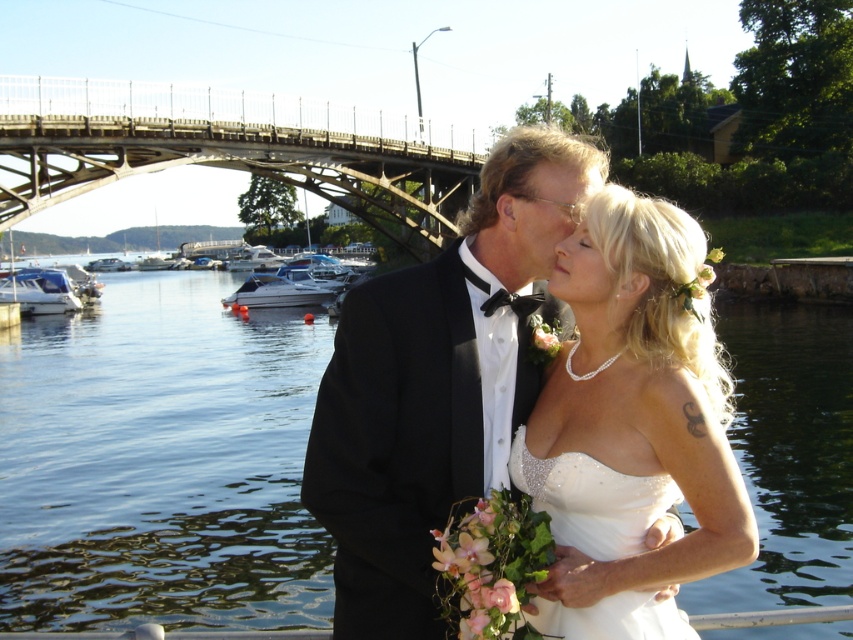
You are a photographer at a waterfront wedding. You need to position a spotlight at the point with coordinates point (221, 154). What object should the spotlight illuminate?

The point (221, 154) indicates the metallic bridge at upper center, so the spotlight should illuminate the metallic bridge at upper center.

You are a photographer at the wedding. You want to capture the couple standing so that the white satin cocktail dress at center is positioned to the right of the clear water at center. Is this possible based on the current scene?

Yes, because the clear water at center is already to the left of the white satin cocktail dress at center, so the dress is naturally positioned to the right of the water.

You are a photographer standing at the waterfront where the wedding couple is posing. You want to take a photo that includes both the clear water at center and the white satin cocktail dress at center. Which object will appear closer to you in the photo?

The white satin cocktail dress at center will appear closer to you in the photo because it is closer to the viewer than the clear water at center.